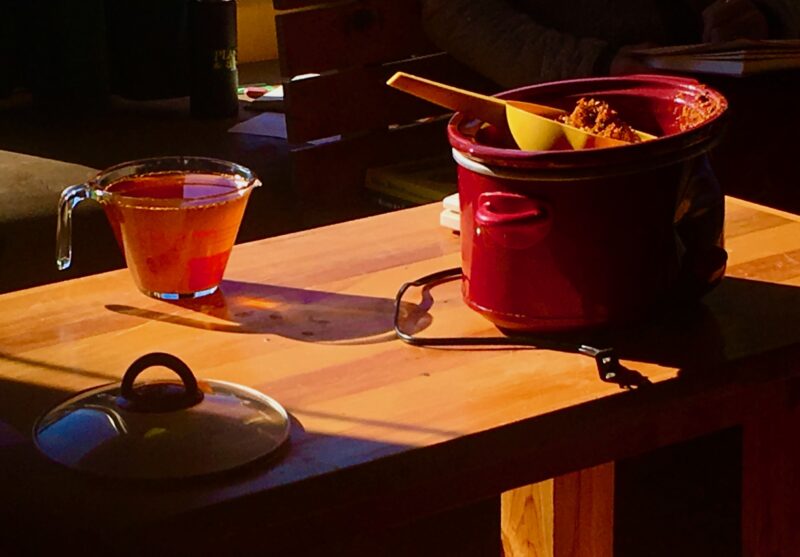
Find the location of a particular element. The width and height of the screenshot is (800, 557). cook book is located at coordinates (734, 58).